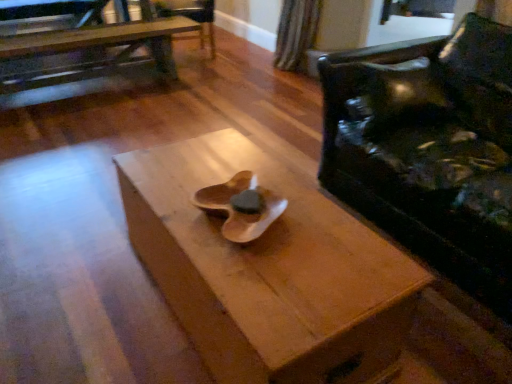
Where is `vacant area on top of wooden table at center, which is counted as the 2th table, starting from the top (from a real-world perspective)`? vacant area on top of wooden table at center, which is counted as the 2th table, starting from the top (from a real-world perspective) is located at coordinates (252, 216).